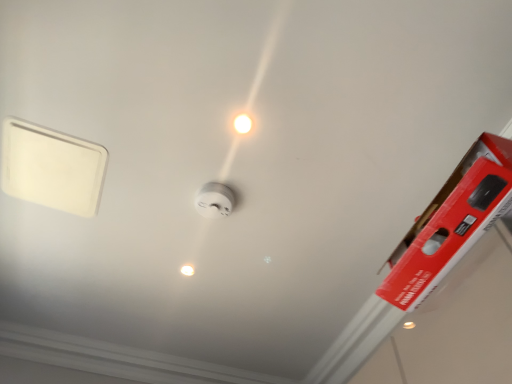
Question: Which direction should I rotate to face white glossy light bulb at center, the first light bulb from the right, — up or down?

Choices:
 (A) up
 (B) down

Answer: (A)

Question: From a real-world perspective, is white plastic smoke detector at center positioned under white glossy light bulb at center, placed as the first light bulb when sorted from left to right, based on gravity?

Choices:
 (A) no
 (B) yes

Answer: (B)

Question: Is white plastic smoke detector at center oriented towards white glossy light bulb at center, which is the second light bulb from right to left?

Choices:
 (A) yes
 (B) no

Answer: (B)

Question: Is white plastic smoke detector at center taller than white glossy light bulb at center, which is the second light bulb from right to left?

Choices:
 (A) no
 (B) yes

Answer: (B)

Question: Does white plastic smoke detector at center come in front of white glossy light bulb at center, acting as the second light bulb starting from the front?

Choices:
 (A) no
 (B) yes

Answer: (B)

Question: Can white glossy light bulb at center, acting as the second light bulb starting from the front, be found inside white plastic smoke detector at center?

Choices:
 (A) yes
 (B) no

Answer: (B)

Question: Considering the relative sizes of white plastic smoke detector at center and white glossy light bulb at center, which is counted as the 1th light bulb, starting from the bottom, in the image provided, is white plastic smoke detector at center smaller than white glossy light bulb at center, which is counted as the 1th light bulb, starting from the bottom,?

Choices:
 (A) no
 (B) yes

Answer: (A)

Question: Considering the relative sizes of white glossy light bulb at center, placed as the first light bulb when sorted from left to right, and white plastic smoke detector at center in the image provided, is white glossy light bulb at center, placed as the first light bulb when sorted from left to right, thinner than white plastic smoke detector at center?

Choices:
 (A) no
 (B) yes

Answer: (B)

Question: Is white glossy light bulb at center, acting as the second light bulb starting from the front, bigger than white plastic smoke detector at center?

Choices:
 (A) yes
 (B) no

Answer: (B)

Question: Is white glossy light bulb at center, which is the second light bulb in top-to-bottom order, beside white plastic smoke detector at center?

Choices:
 (A) yes
 (B) no

Answer: (B)

Question: Considering the relative sizes of white glossy light bulb at center, which is the second light bulb from right to left, and white plastic smoke detector at center in the image provided, is white glossy light bulb at center, which is the second light bulb from right to left, smaller than white plastic smoke detector at center?

Choices:
 (A) yes
 (B) no

Answer: (A)

Question: Is white glossy light bulb at center, arranged as the 1th light bulb when viewed from the back, at the right side of white plastic smoke detector at center?

Choices:
 (A) no
 (B) yes

Answer: (A)

Question: From the image's perspective, is white glossy light bulb at center, acting as the second light bulb starting from the front, below white plastic smoke detector at center?

Choices:
 (A) yes
 (B) no

Answer: (A)

Question: Does white plastic smoke detector at center have a greater width compared to white glossy light bulb at center, the 1th light bulb viewed from the top?

Choices:
 (A) yes
 (B) no

Answer: (A)